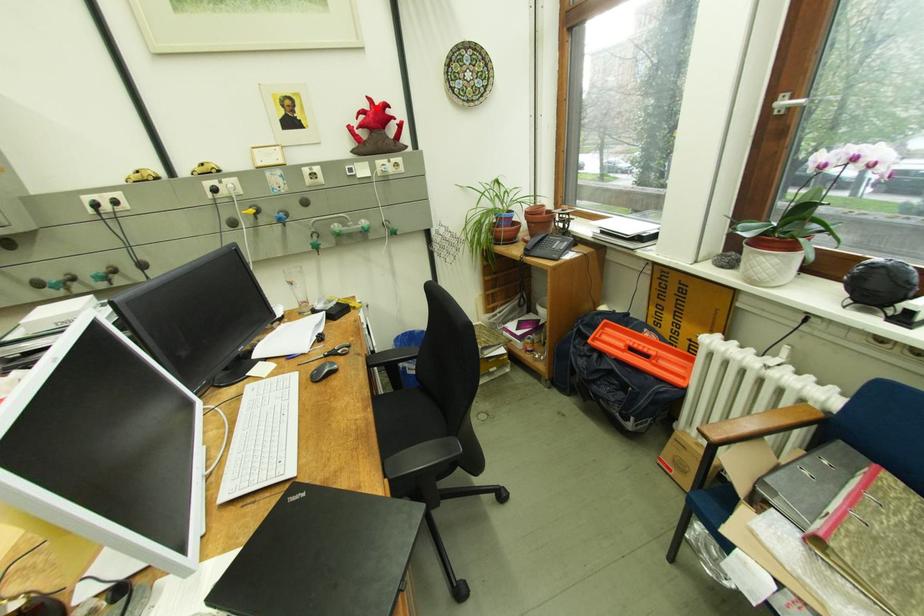
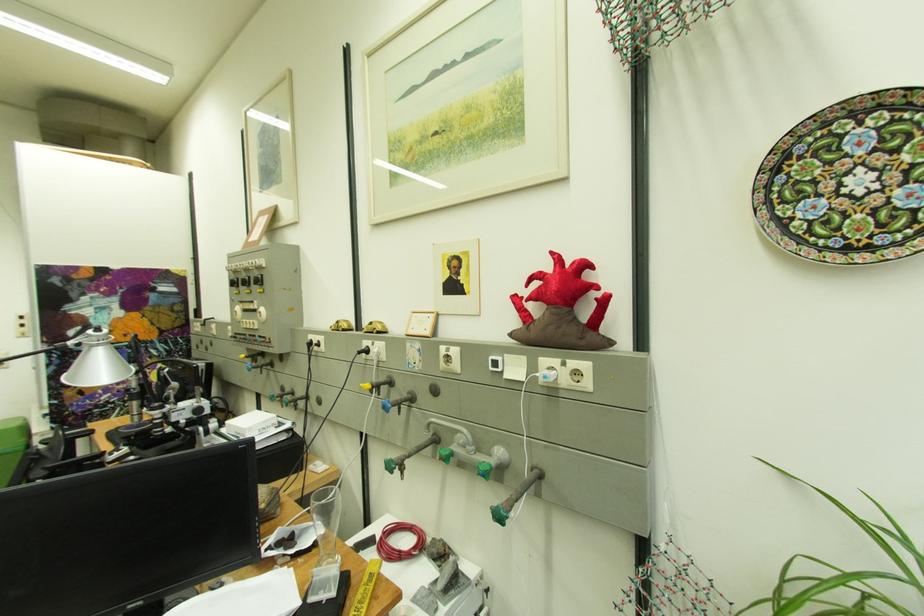
Where in the second image is the point corresponding to the highlighted location from the first image?

(560, 267)